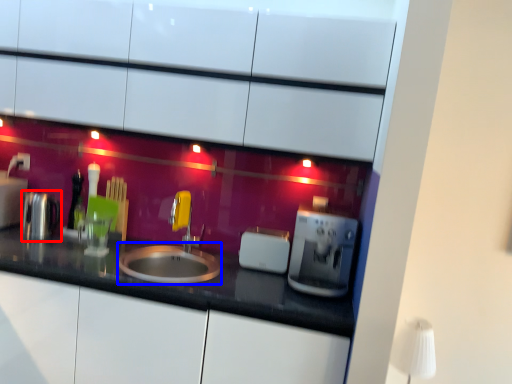
Question: Which point is closer to the camera, appliance (highlighted by a red box) or sink (highlighted by a blue box)?

Choices:
 (A) appliance
 (B) sink

Answer: (B)